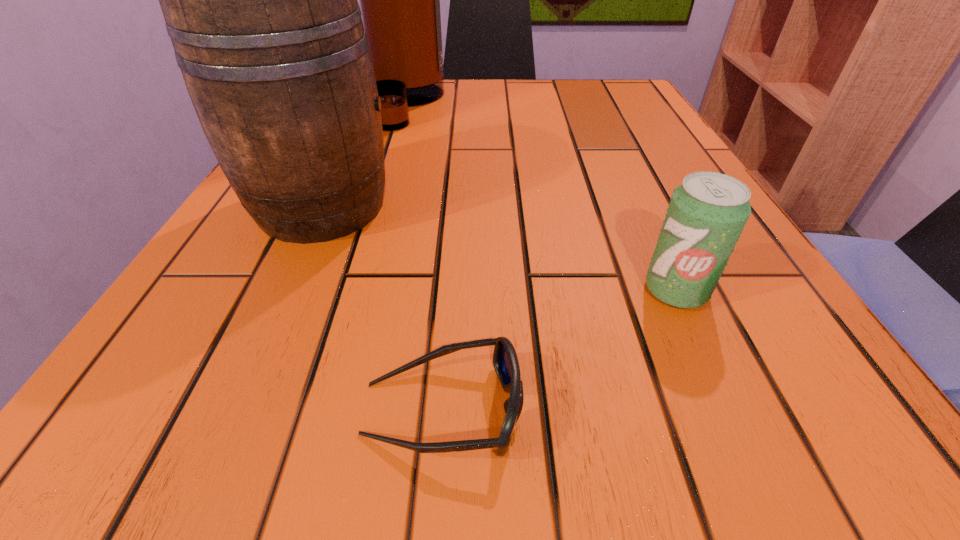
Where is `vacant point that satisfies the following two spatial constraints: 1. on the side of the soda near the bung hole; 2. on the left side of the cider`? The width and height of the screenshot is (960, 540). vacant point that satisfies the following two spatial constraints: 1. on the side of the soda near the bung hole; 2. on the left side of the cider is located at coordinates (283, 290).

The width and height of the screenshot is (960, 540). In order to click on vacant region that satisfies the following two spatial constraints: 1. on the front label of the farthest object; 2. on the right side of the third farthest object in this screenshot , I will do `click(349, 290)`.

The image size is (960, 540). Find the location of `free space that satisfies the following two spatial constraints: 1. on the front label of the liquor; 2. on the left side of the third farthest object`. free space that satisfies the following two spatial constraints: 1. on the front label of the liquor; 2. on the left side of the third farthest object is located at coordinates (349, 290).

I want to click on free space that satisfies the following two spatial constraints: 1. on the front label of the soda; 2. on the right side of the farthest object, so click(x=349, y=290).